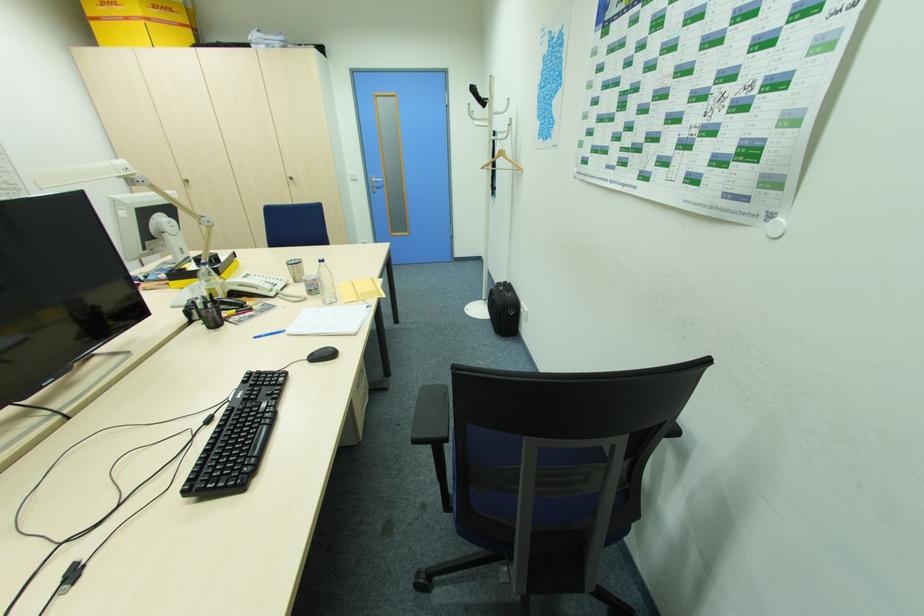
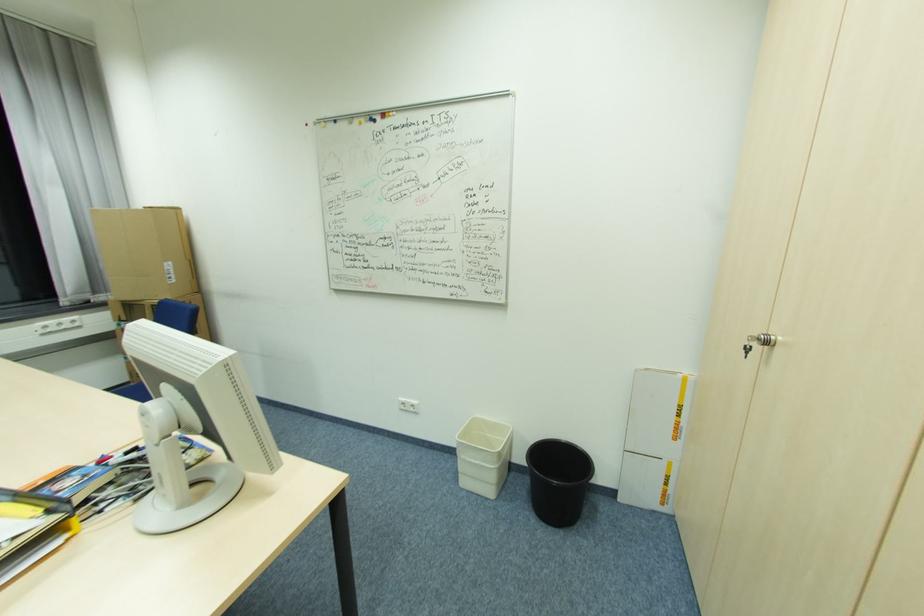
The point at (189,180) is marked in the first image. Where is the corresponding point in the second image?

(772, 344)